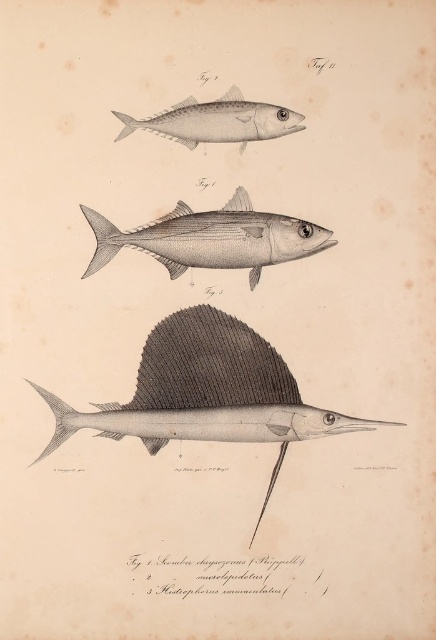
Which is more to the left, gray matte sailfish at center or gray matte fish at upper center?

From the viewer's perspective, gray matte fish at upper center appears more on the left side.

Can you confirm if gray matte sailfish at center is positioned to the left of gray matte fish at upper center?

No, gray matte sailfish at center is not to the left of gray matte fish at upper center.

What do you see at coordinates (207, 392) in the screenshot? I see `gray matte sailfish at center` at bounding box center [207, 392].

This screenshot has height=640, width=436. In order to click on gray matte sailfish at center in this screenshot , I will do `click(207, 392)`.

Who is more distant from viewer, (248, 372) or (92, 256)?

The point (92, 256) is more distant.

Looking at this image, which of these two, gray matte sailfish at center or grayish silver fish at center, stands taller?

With more height is gray matte sailfish at center.

Does point (214, 378) lie behind point (231, 237)?

No, (214, 378) is in front of (231, 237).

The width and height of the screenshot is (436, 640). Find the location of `gray matte sailfish at center`. gray matte sailfish at center is located at coordinates (207, 392).

Looking at this image, is grayish silver fish at center behind gray matte fish at upper center?

Yes.

Looking at this image, can you confirm if grayish silver fish at center is smaller than gray matte fish at upper center?

Actually, grayish silver fish at center might be larger than gray matte fish at upper center.

Is point (306, 237) closer to viewer compared to point (241, 96)?

That is False.

Image resolution: width=436 pixels, height=640 pixels. Identify the location of grayish silver fish at center. (211, 237).